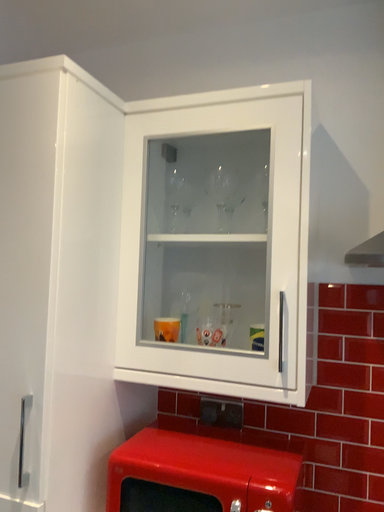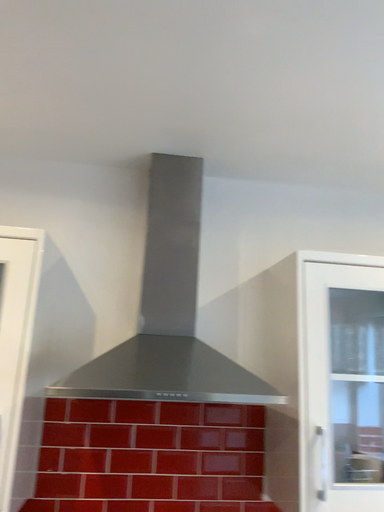
Question: Which way did the camera rotate in the video?

Choices:
 (A) rotated left
 (B) rotated right

Answer: (B)